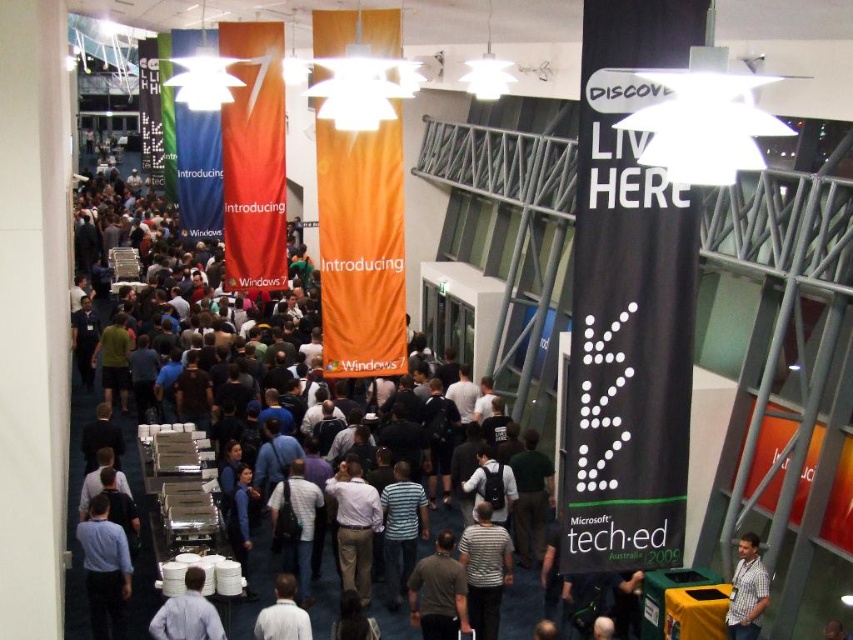
You are a photographer at the event and want to capture a photo of both the light blue shirt at center and the white shirt at center. Since you can only focus on one person at a time, which shirt should you focus on first if you want to capture them both in the frame without moving the camera?

You should focus on the light blue shirt at center first because it is to the left of the white shirt at center. By focusing on the left shirt first, you can ensure both are in the frame as you adjust the camera to include the rightward positioned white shirt.

You are standing in the event space and notice a point marked at coordinates (187,612). Which object in the scene corresponds to this point?

The point at coordinates (187,612) corresponds to the light blue shirt at center.